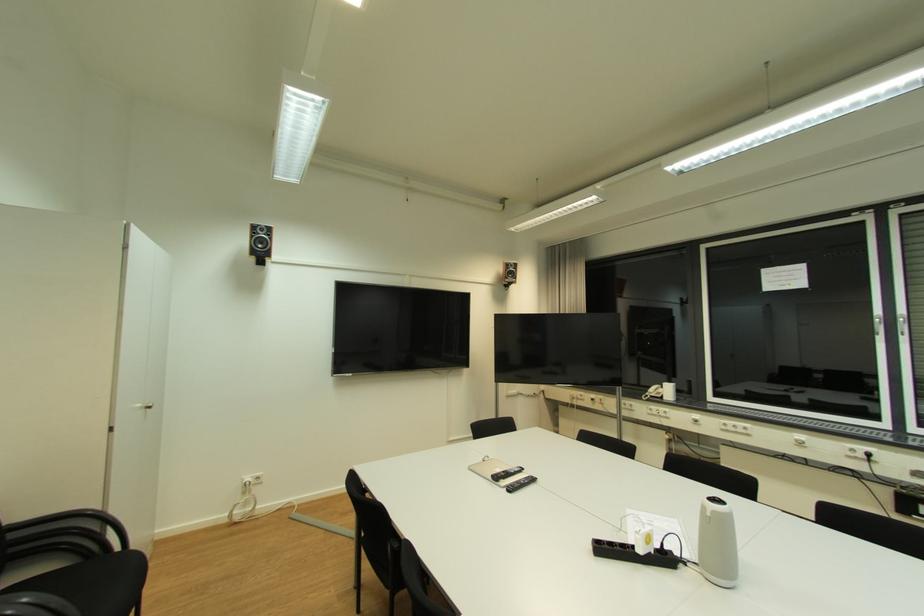
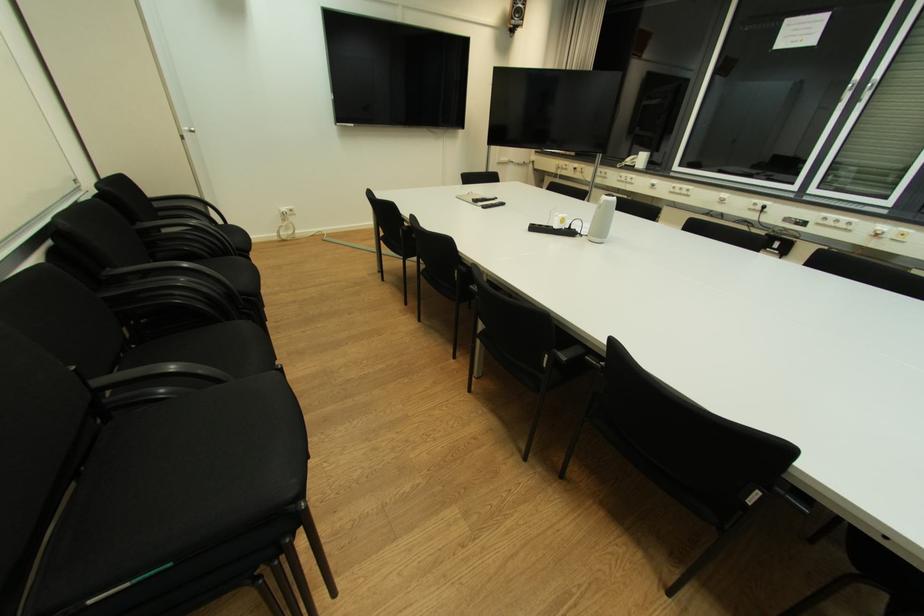
Question: The images are taken continuously from a first-person perspective. In which direction is your viewpoint rotating?

Choices:
 (A) Left
 (B) Right
 (C) Up
 (D) Down

Answer: (D)